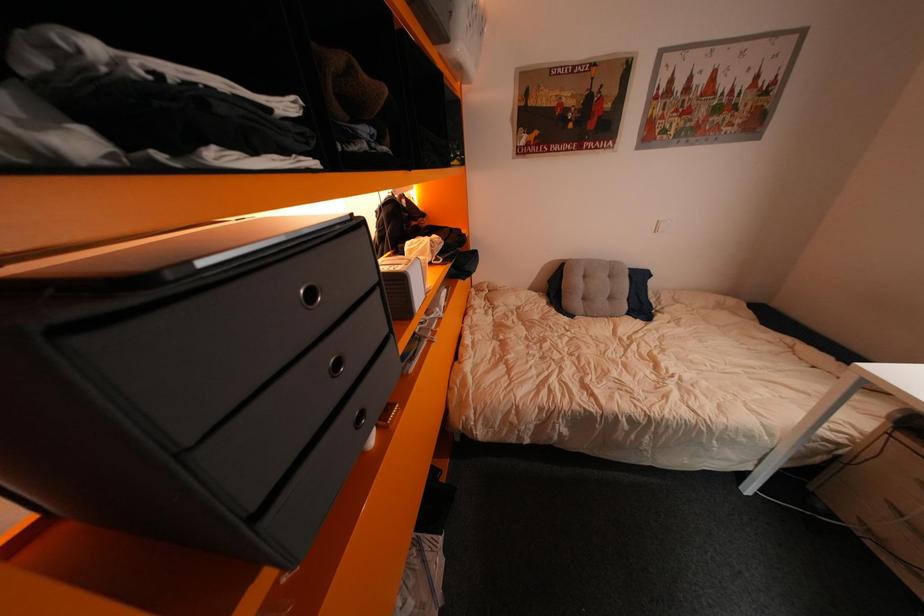
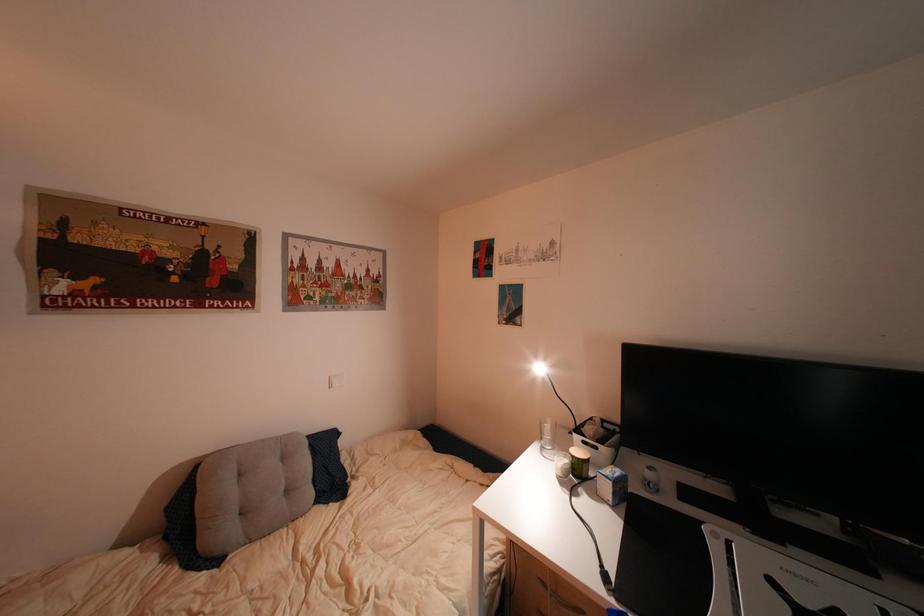
First-person continuous shooting, in which direction is the camera rotating?

The camera's rotation is toward right-up.